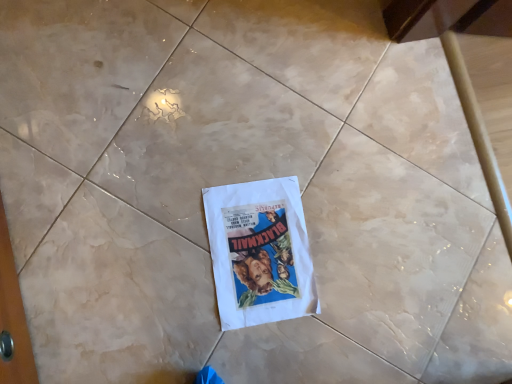
Locate an element on the screen. free space above white paper flyer at center (from a real-world perspective) is located at coordinates (262, 255).